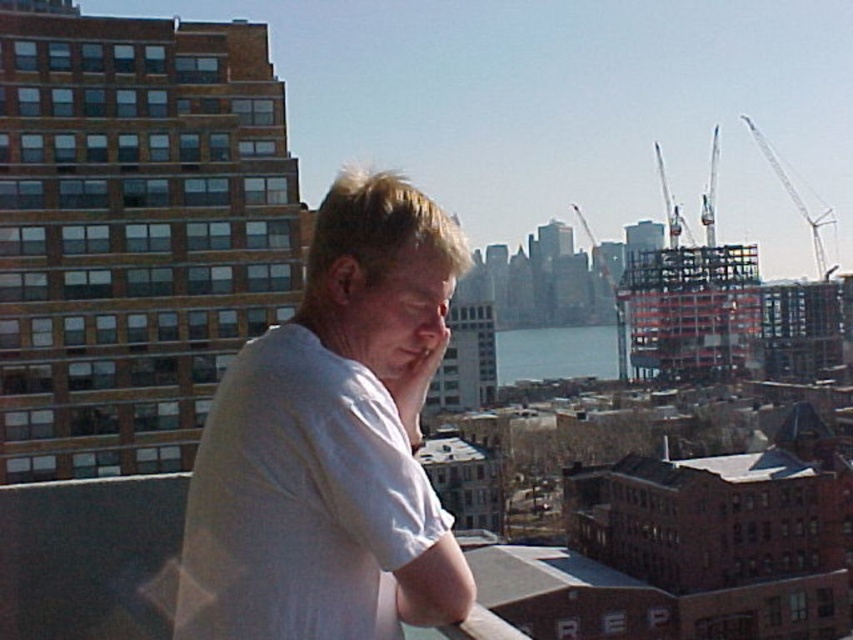
You are a photographer trying to capture the white cotton shirt at center and the white metallic crane at upper right in the same frame. Considering their sizes, which object will appear smaller in the final photo?

The white cotton shirt at center will appear smaller in the photo because it is closer to the camera than the white metallic crane at upper right, which is farther away and thus appears larger despite its actual size.

You are a photographer trying to capture both the white cotton shirt at center and the white metallic crane at upper right in a single frame. Given that your camera has a 50mm lens, which has a field of view of approximately 46 degrees, can you estimate if both objects will fit in the frame?

The white cotton shirt at center and white metallic crane at upper right are 454.94 meters apart from each other. With a 50mm lens providing a 46 degree field of view, the maximum distance between two objects that can be captured in the frame would depend on their distance from the camera. However, since both objects are in the same general vicinity on the rooftop, the 454.94 meter separation is likely too large to fit within the 46 degree field of view. Therefore, it may not be possible to capture both ina

You are a photographer trying to capture a photo of the city skyline. You notice the white cotton shirt at center and the white metallic crane at upper right in your frame. Which object should you adjust your camera focus to ensure the crane is in the background while keeping the shirt in the foreground?

The white cotton shirt at center is located below the white metallic crane at upper right, so to have the crane in the background and the shirt in the foreground, focus on the white cotton shirt at center first, then adjust the focus to include the crane in the background without moving the shirt out of frame.